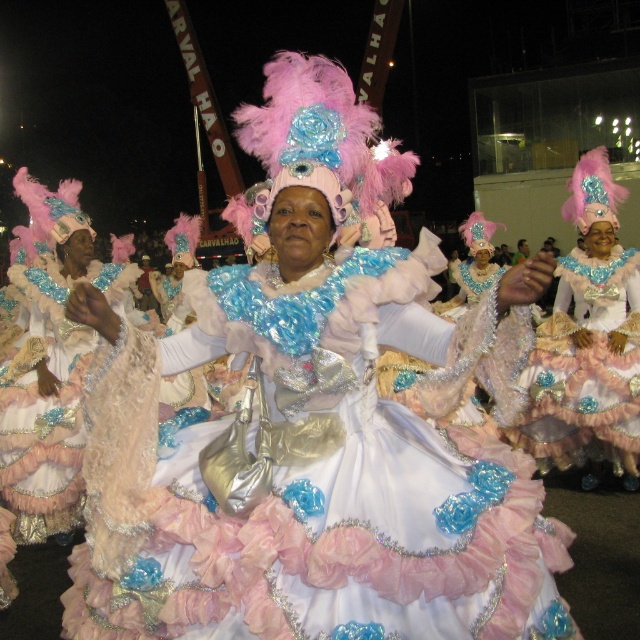
Question: Which object appears farthest from the camera in this image?

Choices:
 (A) shiny sequined dress at center
 (B) frosted lace dress at center

Answer: (A)

Question: Is shiny sequined dress at center wider than frosted lace dress at center?

Choices:
 (A) no
 (B) yes

Answer: (B)

Question: In this image, where is shiny sequined dress at center located relative to frosted lace dress at center?

Choices:
 (A) above
 (B) below

Answer: (A)

Question: Can you confirm if shiny sequined dress at center is positioned below frosted lace dress at center?

Choices:
 (A) yes
 (B) no

Answer: (B)